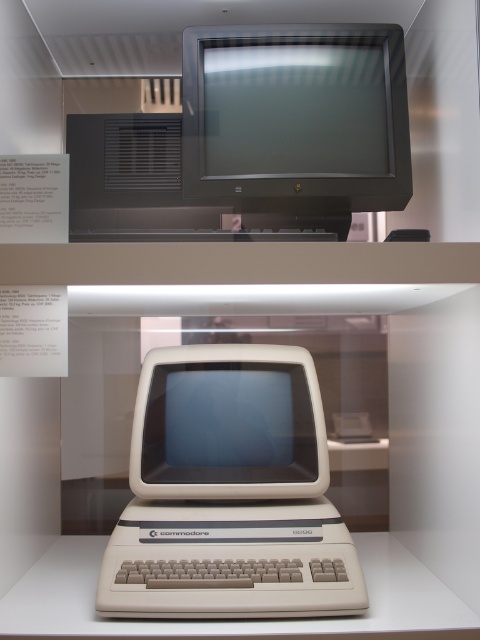
You are a museum visitor standing in front of the display case. You want to take a photo of both the matte black monitor at upper center and the beige plastic monitor at center. Which monitor should you focus on first to ensure both are in focus?

You should focus on the matte black monitor at upper center first because it is closer to you than the beige plastic monitor at center, so adjusting focus from near to far will help both be in focus.

In the scene shown: You are a museum curator who needs to move the beige plastic commodore 64 at center and the matte black monitor at upper center to a new display case. The new case has a shelf that can only accommodate items spaced exactly 45 centimeters apart. Can you fit both items into the new case without adjusting their positions?

The beige plastic commodore 64 at center and the matte black monitor at upper center are currently 46.82 centimeters apart. Since the new shelf requires items to be spaced exactly 45 centimeters apart, they cannot be placed in the new case without adjusting their positions to reduce the distance between them.

You are a museum visitor standing in front of the display case. You see the beige plastic commodore 64 at center and the beige plastic monitor at center. Which one is positioned to the right side?

The beige plastic commodore 64 at center is positioned to the right of the beige plastic monitor at center.